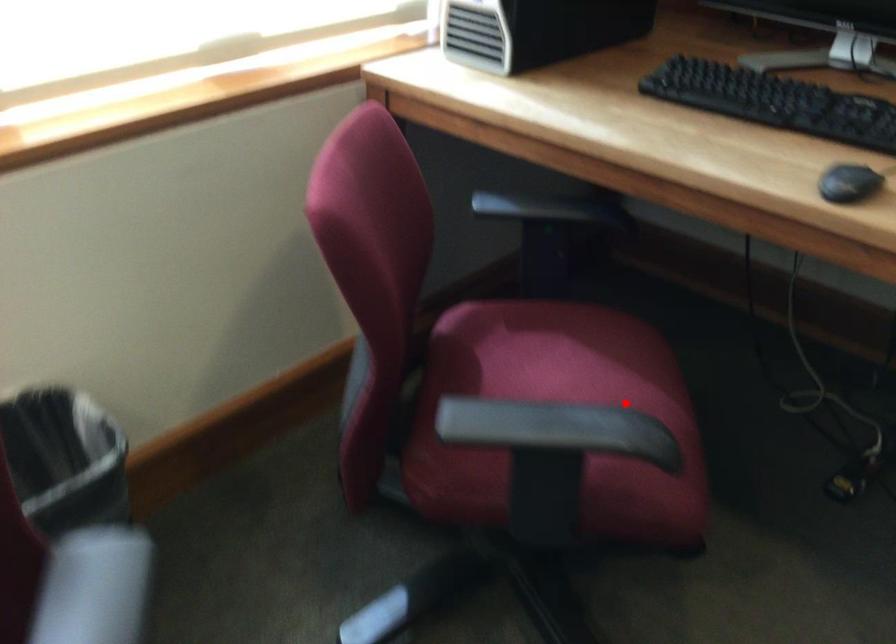
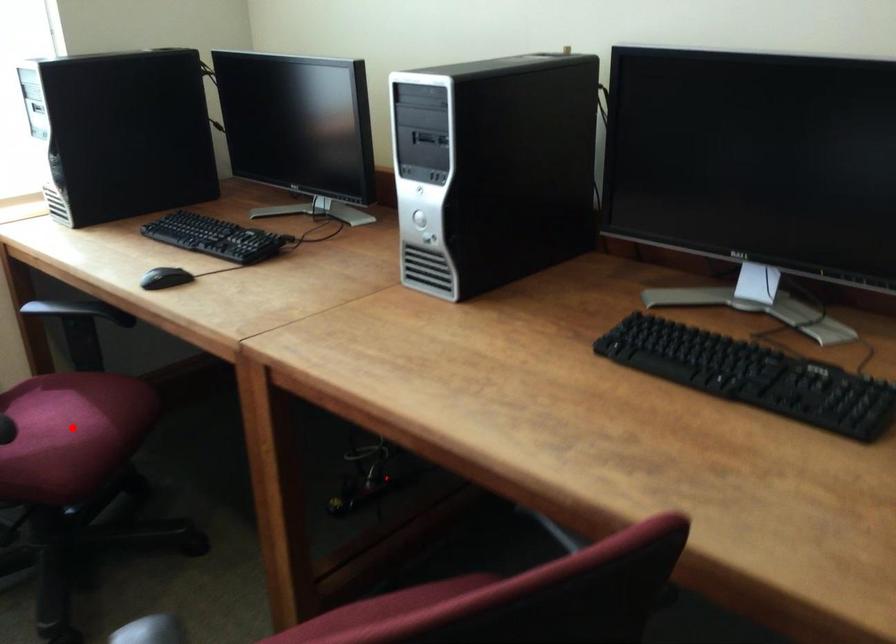
I am providing you with two images of the same scene from different viewpoints. A red point is marked on the first image and another point is marked on the second image. Are the points marked in image1 and image2 representing the same 3D position?

Yes